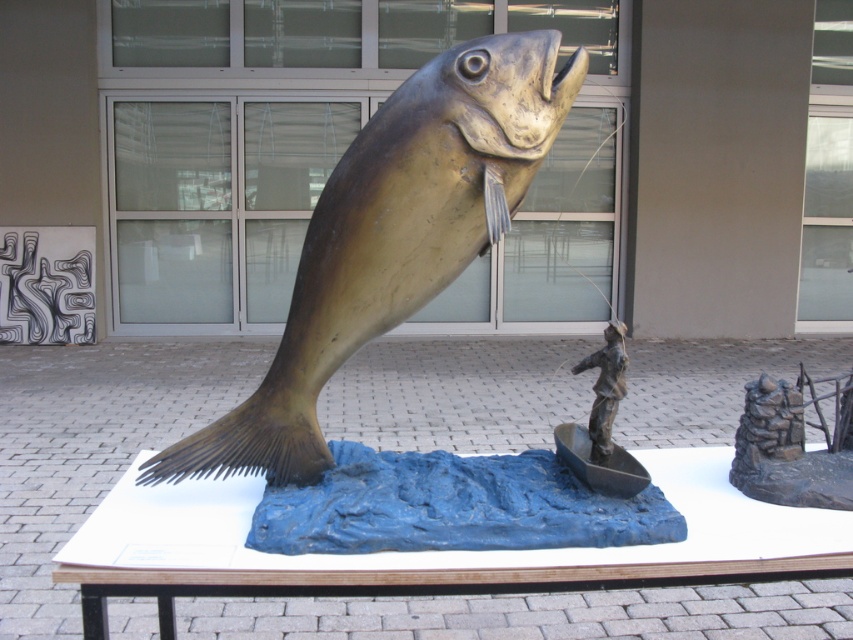
You are standing in front of the sculpture and want to place a decorative plaque on the object that is above the other. Which object should you choose between rustic stone wall at center and bronze fisherman in boat at center?

The bronze fisherman in boat at center is above the rustic stone wall at center, so you should place the plaque on the bronze fisherman in boat at center.